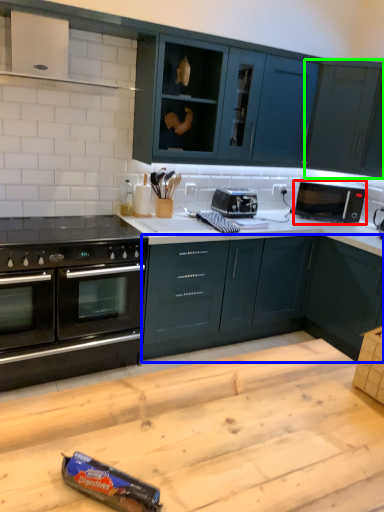
Question: Which object is the closest to the microwave oven (highlighted by a red box)? Choose among these: cabinetry (highlighted by a blue box) or cabinetry (highlighted by a green box).

Choices:
 (A) cabinetry
 (B) cabinetry

Answer: (B)